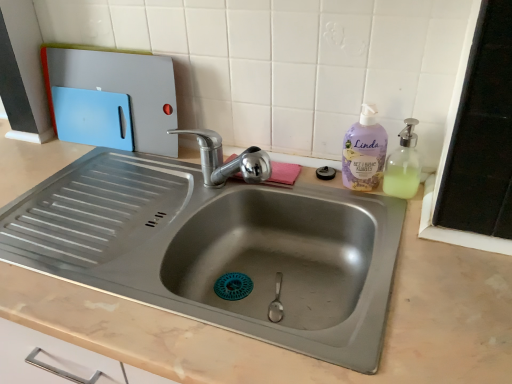
Question: Choose the correct answer: Is lavender plastic bottle at right inside blue plastic cutting board at upper left or outside it?

Choices:
 (A) outside
 (B) inside

Answer: (A)

Question: Is lavender plastic bottle at right bigger or smaller than blue plastic cutting board at upper left?

Choices:
 (A) small
 (B) big

Answer: (A)

Question: Which is nearer to the blue plastic cutting board at upper left?

Choices:
 (A) lavender plastic bottle at right
 (B) translucent plastic soap dispenser at right

Answer: (A)

Question: Estimate the real-world distances between objects in this image. Which object is farther from the translucent plastic soap dispenser at right?

Choices:
 (A) lavender plastic bottle at right
 (B) blue plastic cutting board at upper left

Answer: (B)